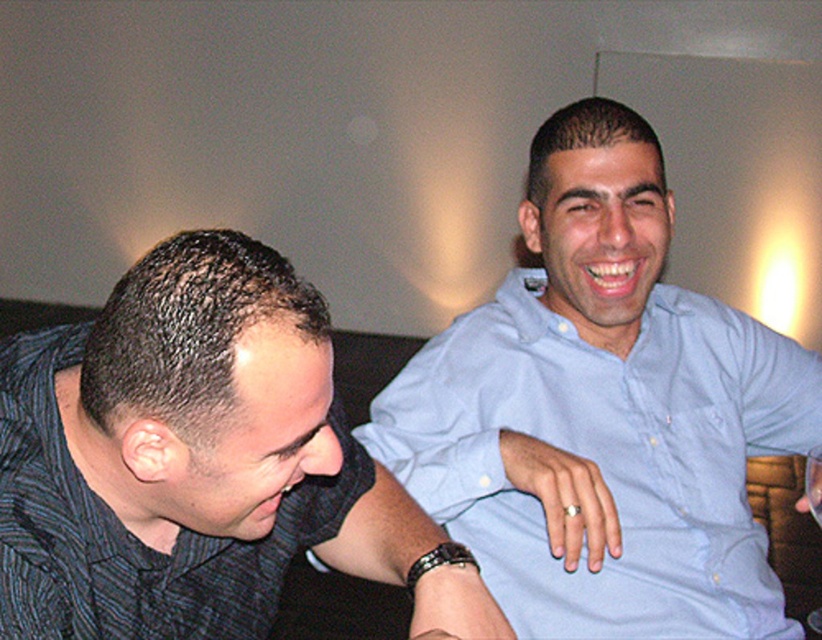
Between point (556, 440) and point (820, 509), which one is positioned behind?

Point (556, 440)

Does light blue cotton shirt at right appear on the right side of transparent glass at upper left?

Incorrect, light blue cotton shirt at right is not on the right side of transparent glass at upper left.

What do you see at coordinates (607, 458) in the screenshot? I see `light blue cotton shirt at right` at bounding box center [607, 458].

This screenshot has width=822, height=640. In order to click on light blue cotton shirt at right in this screenshot , I will do `click(607, 458)`.

Is dark blue striped shirt at left closer to camera compared to light blue cotton shirt at right?

Yes, it is in front of light blue cotton shirt at right.

Between point (132, 358) and point (724, 365), which one is positioned in front?

Positioned in front is point (132, 358).

I want to click on dark blue striped shirt at left, so pos(199,464).

Does dark blue striped shirt at left appear under transparent glass at upper left?

No.

What do you see at coordinates (199, 464) in the screenshot? The width and height of the screenshot is (822, 640). I see `dark blue striped shirt at left` at bounding box center [199, 464].

Find the location of a particular element. dark blue striped shirt at left is located at coordinates (199, 464).